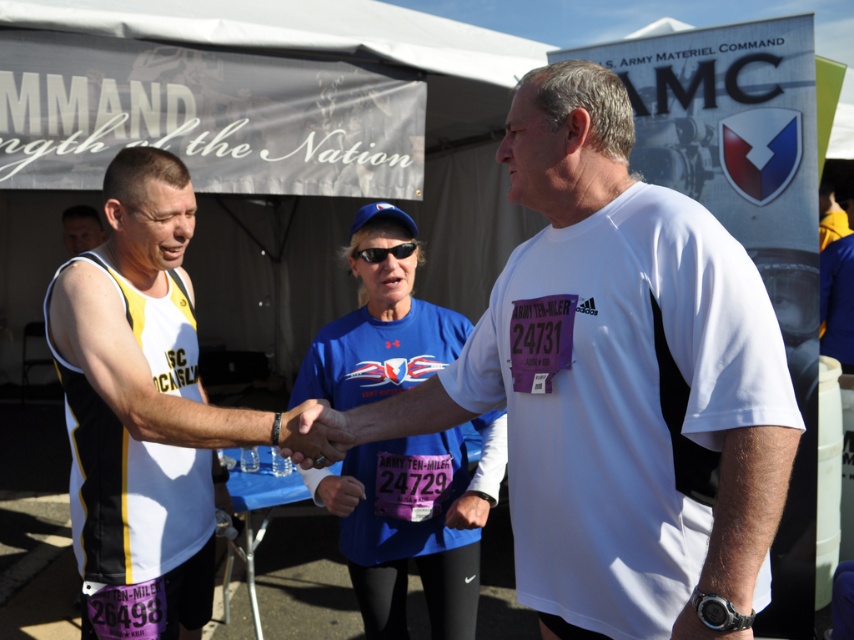
You are a photographer at the Army Ten Miler event. You need to capture a photo of both the white jersey at center and the blue fabric shirt at center. Which one is visible on top in the image?

The white jersey at center is positioned over blue fabric shirt at center, so the white jersey at center is visible on top.